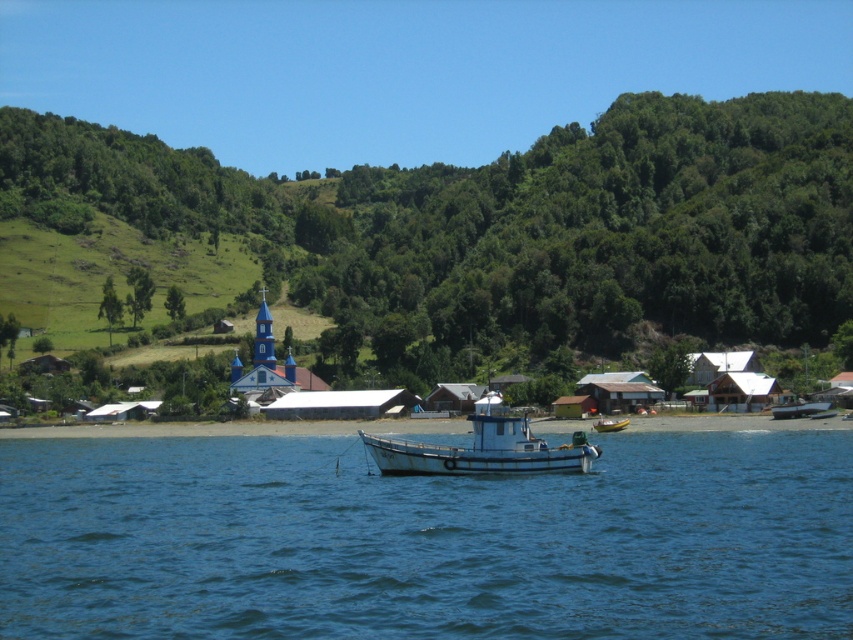
Question: Which object is farther from the camera taking this photo?

Choices:
 (A) green grassy hillside at upper center
 (B) white matte boat at center
 (C) white plastic boat at lower right

Answer: (A)

Question: Estimate the real-world distances between objects in this image. Which object is closer to the blue water at center?

Choices:
 (A) white corrugated metal houses at center
 (B) green grassy hillside at upper center

Answer: (A)

Question: Is white plastic boat at lower right smaller than yellow rubber boat at center?

Choices:
 (A) no
 (B) yes

Answer: (A)

Question: Is blue water at center to the left of white plastic boat at lower right from the viewer's perspective?

Choices:
 (A) yes
 (B) no

Answer: (A)

Question: Can you confirm if blue water at center is thinner than white plastic boat at lower right?

Choices:
 (A) yes
 (B) no

Answer: (B)

Question: Which object is farther from the camera taking this photo?

Choices:
 (A) white plastic boat at lower right
 (B) yellow rubber boat at center

Answer: (A)